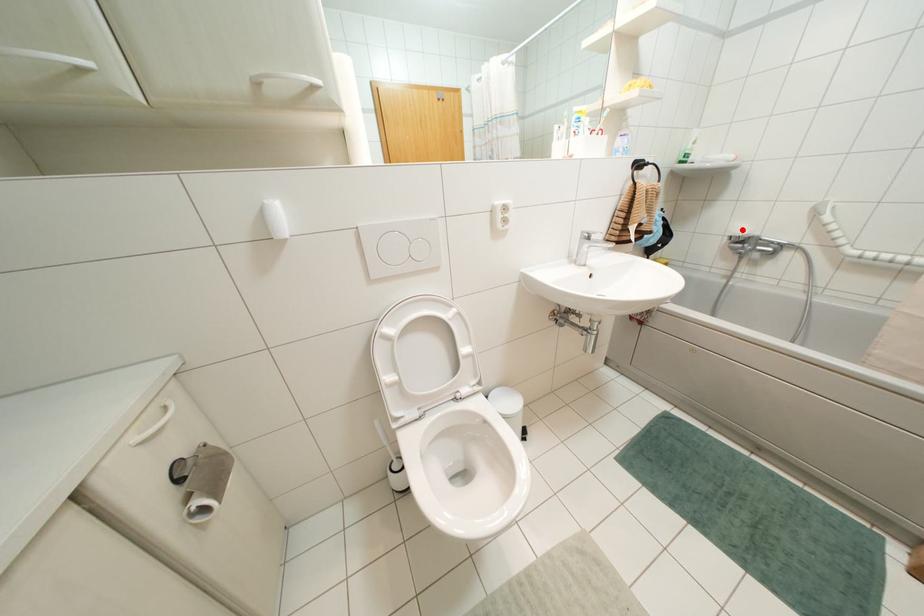
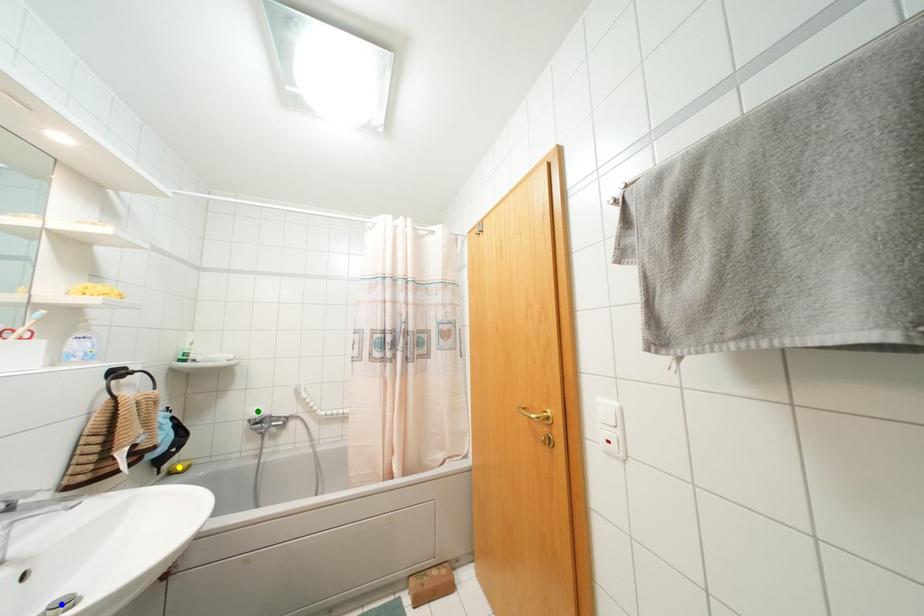
Question: I am providing you with two images of the same scene from different viewpoints. A red point is marked on the first image. You are given multiple points on the second image. In image 2, which mark is for the same physical point as the one in image 1?

Choices:
 (A) green point
 (B) yellow point
 (C) blue point

Answer: (A)